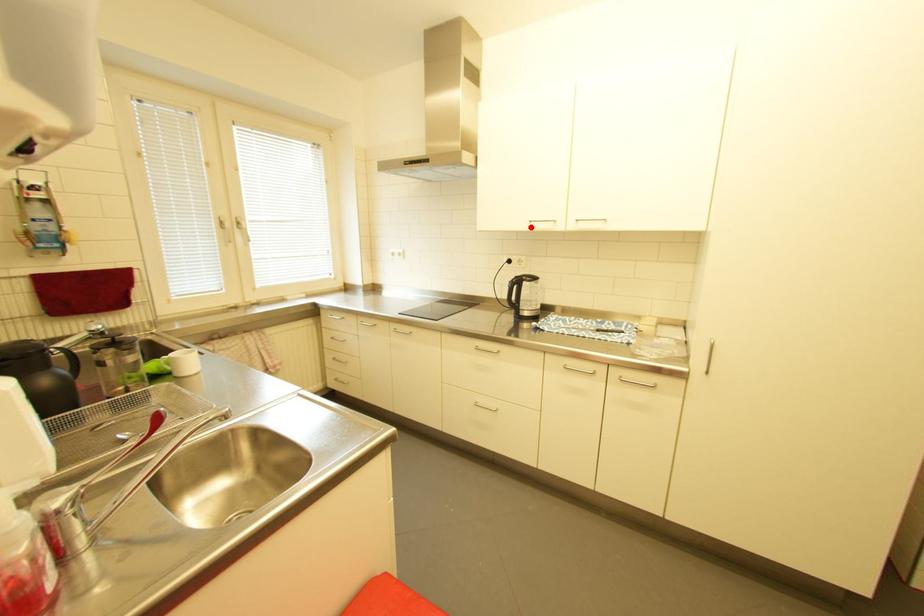
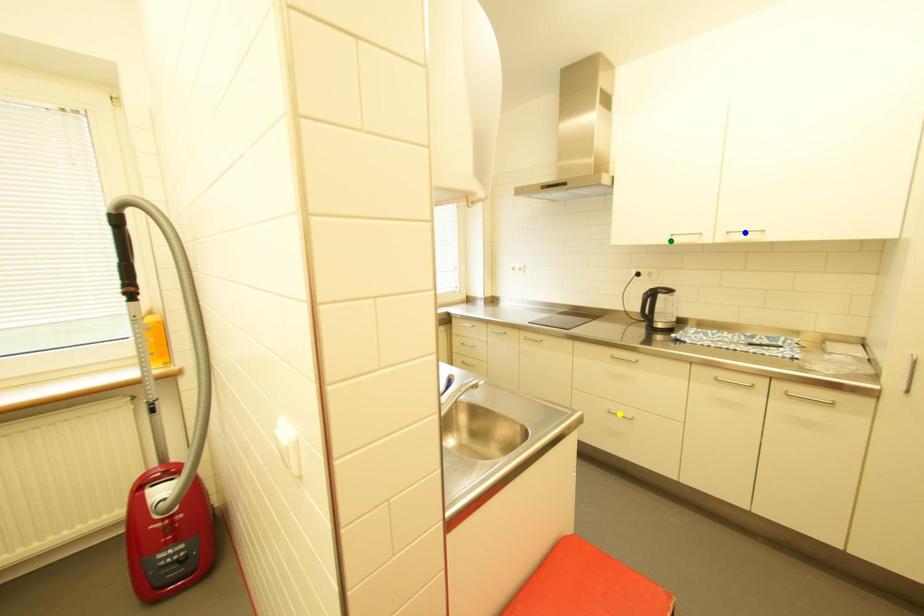
Question: I am providing you with two images of the same scene from different viewpoints. A red point is marked on the first image. You are given multiple points on the second image. Which spot in image 2 lines up with the point in image 1?

Choices:
 (A) yellow point
 (B) green point
 (C) blue point

Answer: (B)